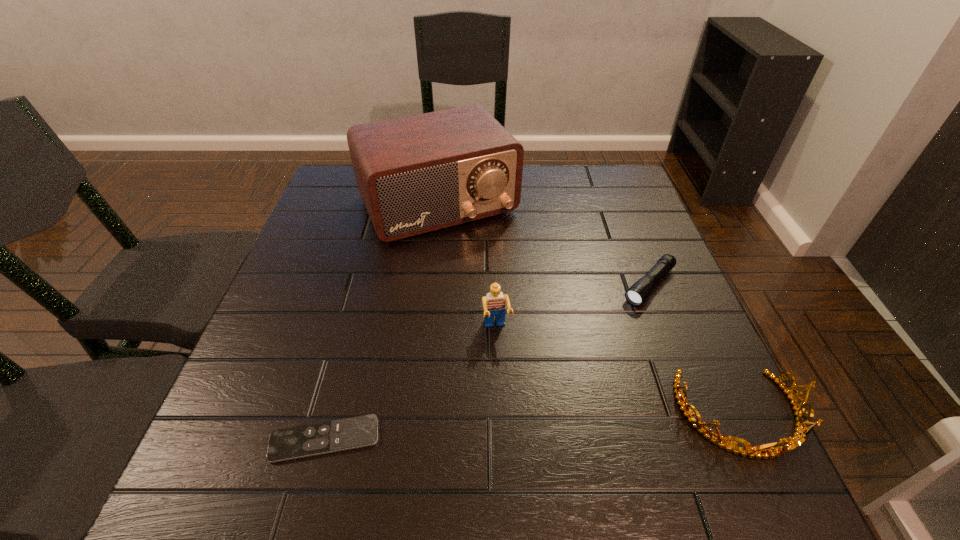
I want to click on free spot on the desktop that is between the shortest object and the third tallest object and is positioned at the lens end of the flashlight, so (516, 428).

The height and width of the screenshot is (540, 960). I want to click on vacant space on the desktop that is between the shortest object and the third shortest object and is positioned on the front panel of the radio receiver, so click(x=572, y=424).

This screenshot has height=540, width=960. Find the location of `vacant space on the desktop that is between the shortest object and the tiara and is positioned on the face of the Lego`. vacant space on the desktop that is between the shortest object and the tiara and is positioned on the face of the Lego is located at coordinates (516, 428).